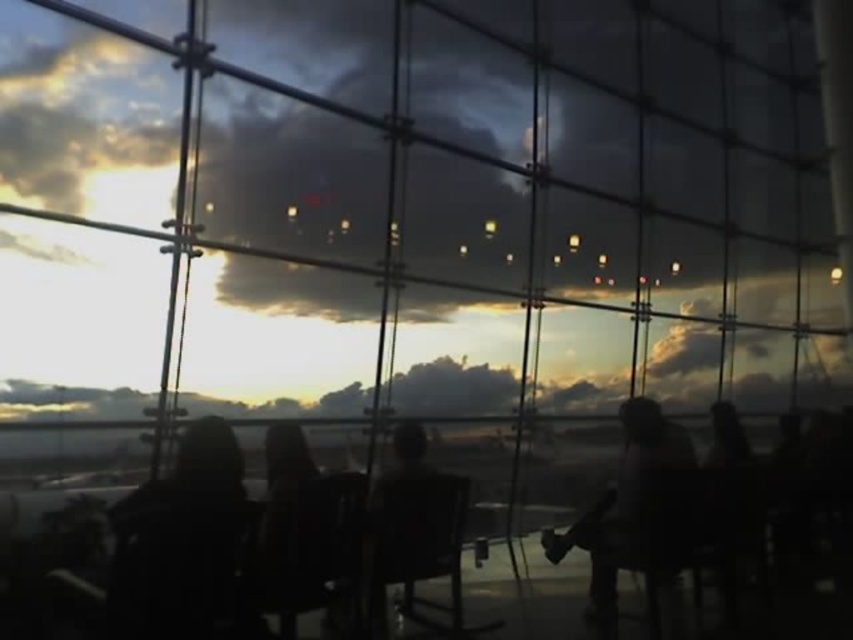
You are standing in an airport terminal and want to take a photo of the black matte jacket at left and the silhouette figure at right through the window. The camera you have can focus on objects up to 6 feet apart. Will both subjects be in focus?

The black matte jacket at left and silhouette figure at right are 5.88 feet apart from each other, so yes, both subjects will be in focus since the distance between them is within the camera focus range of 6 feet.

You are an airport security officer observing the scene through the window. You notice a black matte jacket at left and a silhouette figure at right. Which object is closer to you, the observer?

The black matte jacket at left is closer to you because it is positioned over the silhouette figure at right, indicating it is in a nearer plane.